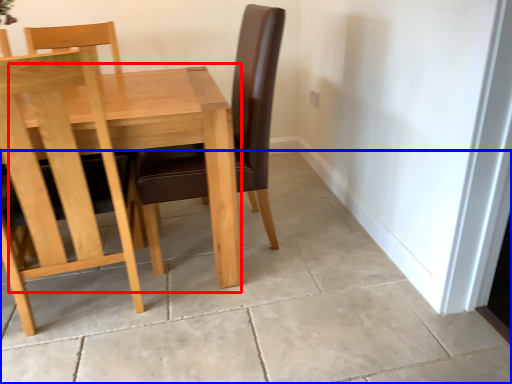
Question: Among these objects, which one is farthest to the camera, table (highlighted by a red box) or concrete (highlighted by a blue box)?

Choices:
 (A) table
 (B) concrete

Answer: (A)